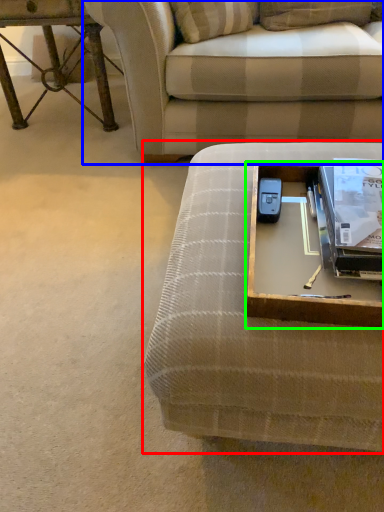
Question: Which object is the farthest from studio couch (highlighted by a red box)? Choose among these: studio couch (highlighted by a blue box) or round table (highlighted by a green box).

Choices:
 (A) studio couch
 (B) round table

Answer: (A)